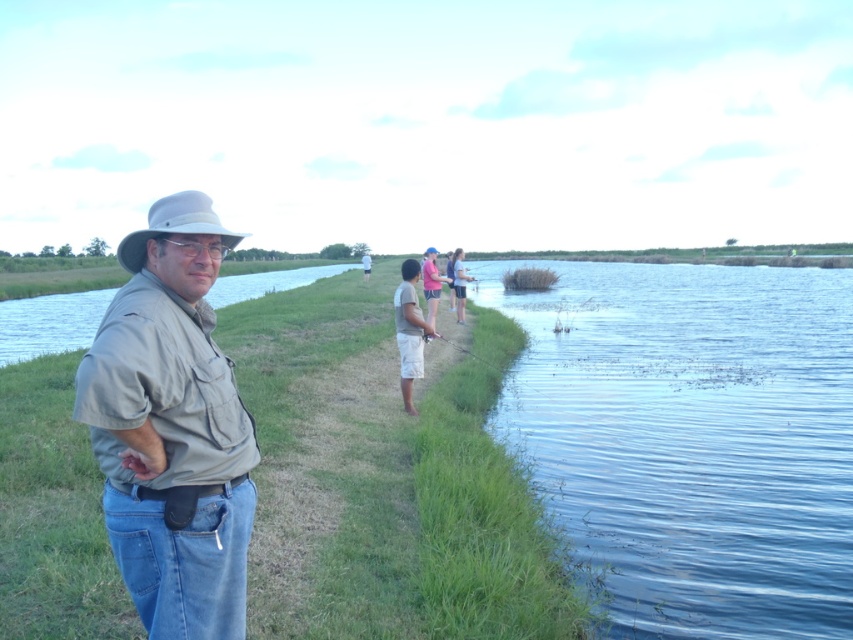
Which is more to the left, blue-green water at center or light blue denim shorts at center?

blue-green water at center is more to the left.

Which is in front, point (107, 296) or point (460, 291)?

Point (460, 291) is more forward.

Is point (94, 291) closer to viewer compared to point (462, 308)?

No, (94, 291) is behind (462, 308).

At what (x,y) coordinates should I click in order to perform the action: click on blue-green water at center. Please return your answer as a coordinate pair (x, y). The height and width of the screenshot is (640, 853). Looking at the image, I should click on (49, 323).

From the picture: Is blue-green water at center above tan cotton shorts at center?

→ Correct, blue-green water at center is located above tan cotton shorts at center.

How much distance is there between blue-green water at center and tan cotton shorts at center?

blue-green water at center is 26.03 meters from tan cotton shorts at center.

The height and width of the screenshot is (640, 853). Identify the location of blue-green water at center. (49, 323).

Does pink fabric shirt at center have a lesser width compared to light blue denim jeans at center?

Yes, pink fabric shirt at center is thinner than light blue denim jeans at center.

Describe the element at coordinates (431, 289) in the screenshot. I see `pink fabric shirt at center` at that location.

Who is more distant from viewer, (422, 278) or (366, 280)?

Positioned behind is point (366, 280).

This screenshot has width=853, height=640. What are the coordinates of `pink fabric shirt at center` in the screenshot? It's located at (431, 289).